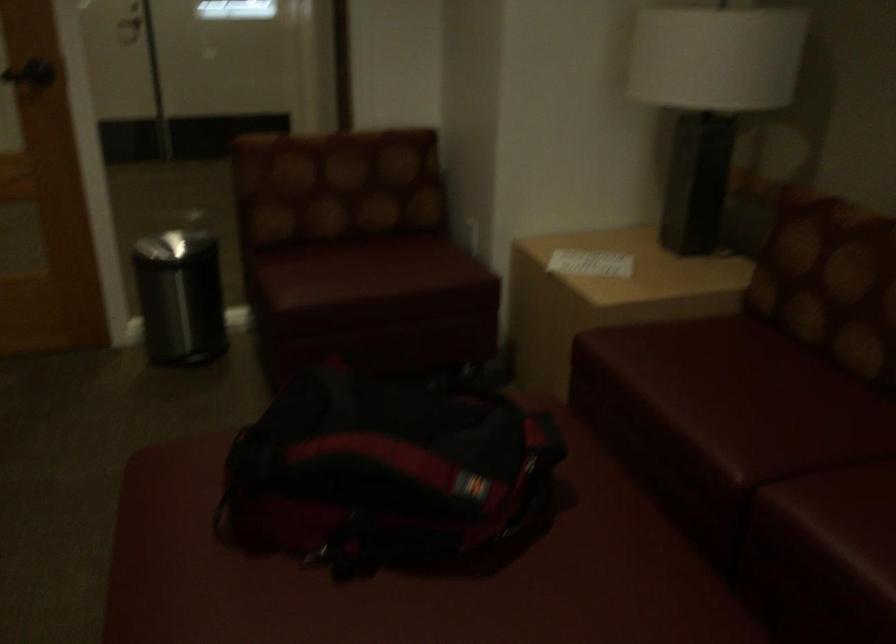
The height and width of the screenshot is (644, 896). What do you see at coordinates (30, 73) in the screenshot? I see `the dark door handle` at bounding box center [30, 73].